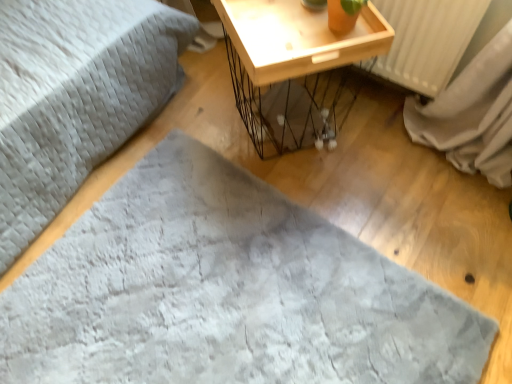
I want to click on wooden tray at upper right, so click(x=295, y=67).

The height and width of the screenshot is (384, 512). Describe the element at coordinates (295, 67) in the screenshot. I see `wooden tray at upper right` at that location.

Where is `gray soft fabric at center`? The width and height of the screenshot is (512, 384). gray soft fabric at center is located at coordinates (226, 292).

Image resolution: width=512 pixels, height=384 pixels. Describe the element at coordinates (226, 292) in the screenshot. I see `gray soft fabric at center` at that location.

Where is `wooden tray at upper right`? The height and width of the screenshot is (384, 512). wooden tray at upper right is located at coordinates coord(295,67).

Is gray soft fabric at center to the left of wooden tray at upper right from the viewer's perspective?

Yes, gray soft fabric at center is to the left of wooden tray at upper right.

In the image, is gray soft fabric at center positioned in front of or behind wooden tray at upper right?

gray soft fabric at center is in front of wooden tray at upper right.

Which point is more forward, (258, 284) or (240, 65)?

Positioned in front is point (258, 284).

From the image's perspective, would you say gray soft fabric at center is positioned over wooden tray at upper right?

Actually, gray soft fabric at center appears below wooden tray at upper right in the image.

From the picture: From a real-world perspective, is gray soft fabric at center on top of wooden tray at upper right?

Actually, gray soft fabric at center is physically below wooden tray at upper right in the real world.

Which of these two, gray soft fabric at center or wooden tray at upper right, is thinner?

wooden tray at upper right is thinner.

Is gray soft fabric at center taller than wooden tray at upper right?

No, gray soft fabric at center is not taller than wooden tray at upper right.

Can you confirm if gray soft fabric at center is smaller than wooden tray at upper right?

Yes.

Is gray soft fabric at center inside or outside of wooden tray at upper right?

gray soft fabric at center is located beyond the bounds of wooden tray at upper right.

Is the surface of gray soft fabric at center in direct contact with wooden tray at upper right?

gray soft fabric at center and wooden tray at upper right are clearly separated.

Is gray soft fabric at center facing towards wooden tray at upper right?

No, gray soft fabric at center is not oriented towards wooden tray at upper right.

Image resolution: width=512 pixels, height=384 pixels. Identify the location of table behind the gray soft fabric at center. (295, 67).

Considering the relative positions of wooden tray at upper right and gray soft fabric at center in the image provided, is wooden tray at upper right to the right of gray soft fabric at center from the viewer's perspective?

Indeed, wooden tray at upper right is positioned on the right side of gray soft fabric at center.

Does wooden tray at upper right come in front of gray soft fabric at center?

No, wooden tray at upper right is behind gray soft fabric at center.

Considering the positions of point (282, 45) and point (246, 320), is point (282, 45) closer or farther from the camera than point (246, 320)?

Clearly, point (282, 45) is closer to the camera than point (246, 320).

From the image's perspective, which one is positioned lower, wooden tray at upper right or gray soft fabric at center?

gray soft fabric at center, from the image's perspective.

From a real-world perspective, is wooden tray at upper right positioned over gray soft fabric at center based on gravity?

Yes, from a real-world perspective, wooden tray at upper right is above gray soft fabric at center.

Which object is wider, wooden tray at upper right or gray soft fabric at center?

With larger width is gray soft fabric at center.

Considering the sizes of objects wooden tray at upper right and gray soft fabric at center in the image provided, who is shorter, wooden tray at upper right or gray soft fabric at center?

Standing shorter between the two is gray soft fabric at center.

Based on the photo, does wooden tray at upper right have a larger size compared to gray soft fabric at center?

Yes, wooden tray at upper right is bigger than gray soft fabric at center.

Is wooden tray at upper right positioned beyond the bounds of gray soft fabric at center?

wooden tray at upper right is positioned outside gray soft fabric at center.

Is wooden tray at upper right touching gray soft fabric at center?

No, wooden tray at upper right is not next to gray soft fabric at center.

Is wooden tray at upper right facing away from gray soft fabric at center?

No, wooden tray at upper right is not facing away from gray soft fabric at center.

The height and width of the screenshot is (384, 512). In the image, there is a wooden tray at upper right. Identify the location of sheet below it (from a real-world perspective). (226, 292).

Locate an element on the screen. The height and width of the screenshot is (384, 512). sheet on the left side of wooden tray at upper right is located at coordinates click(x=226, y=292).

Find the location of a particular element. Image resolution: width=512 pixels, height=384 pixels. sheet beneath the wooden tray at upper right (from a real-world perspective) is located at coordinates (226, 292).